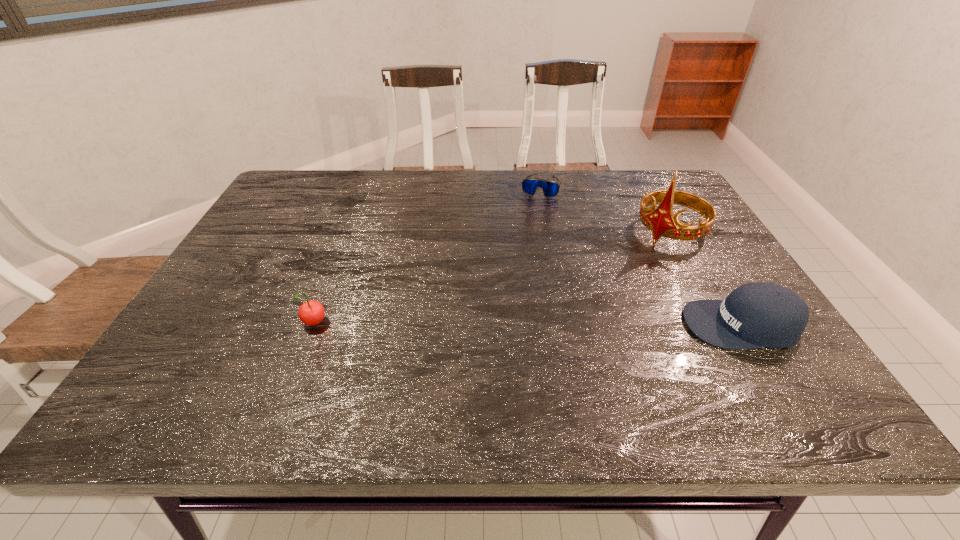
Identify the location of empty space between the tallest object and the leftmost object. (492, 279).

Image resolution: width=960 pixels, height=540 pixels. In order to click on blank region between the tiara and the leftmost object in this screenshot , I will do `click(492, 279)`.

Locate an element on the screen. blank region between the baseball cap and the cherry is located at coordinates (528, 325).

Find the location of a particular element. free spot between the baseball cap and the tallest object is located at coordinates (705, 279).

You are a GUI agent. You are given a task and a screenshot of the screen. Output one action in this format:
    pyautogui.click(x=<x>, y=<y>)
    Task: Click on the empty space that is in between the tallest object and the leftmost object
    The height and width of the screenshot is (540, 960).
    Given the screenshot: What is the action you would take?
    pyautogui.click(x=492, y=279)

Locate an element on the screen. free space between the sunglasses and the tallest object is located at coordinates (604, 209).

Find the location of a particular element. The width and height of the screenshot is (960, 540). free space between the leftmost object and the tiara is located at coordinates click(492, 279).

Identify the location of free space between the leftmost object and the sunglasses. (427, 255).

Identify the location of object that is the third closest to the cherry. (661, 221).

Point out which object is positioned as the second nearest to the tiara. Please provide its 2D coordinates. Your answer should be formatted as a tuple, i.e. [(x, y)], where the tuple contains the x and y coordinates of a point satisfying the conditions above.

[(550, 188)]